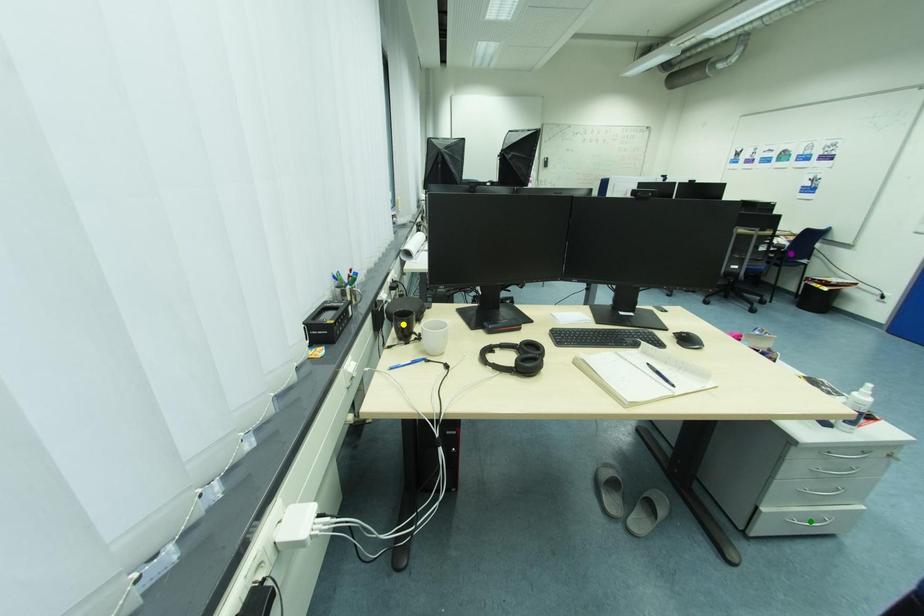
Order these from nearest to farthest:
green point, yellow point, purple point

purple point < yellow point < green point